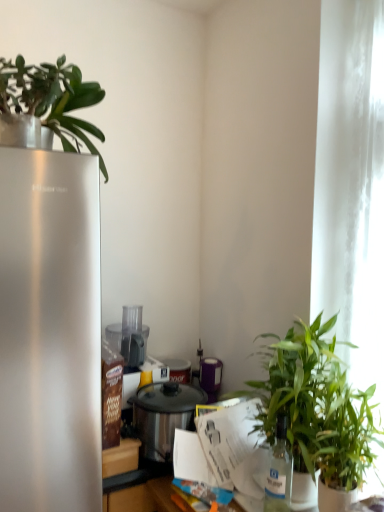
Question: Can you confirm if green leafy plant at right, the 3th houseplant positioned from the top, is positioned to the left of white glossy paper at center?

Choices:
 (A) no
 (B) yes

Answer: (A)

Question: Is green leafy plant at right, the 3th houseplant positioned from the top, positioned in front of white glossy paper at center?

Choices:
 (A) no
 (B) yes

Answer: (B)

Question: Can you confirm if green leafy plant at right, the 1th houseplant positioned from the right, is shorter than white glossy paper at center?

Choices:
 (A) yes
 (B) no

Answer: (B)

Question: Is green leafy plant at right, the 1th houseplant positioned from the right, facing away from white glossy paper at center?

Choices:
 (A) yes
 (B) no

Answer: (B)

Question: Is white glossy paper at center a part of green leafy plant at right, the third houseplant positioned from the left?

Choices:
 (A) yes
 (B) no

Answer: (B)

Question: Does point (326, 388) appear closer or farther from the camera than point (178, 394)?

Choices:
 (A) farther
 (B) closer

Answer: (B)

Question: Is green leafy plant at right, the 1th houseplant in the bottom-to-top sequence, to the left or to the right of stainless steel pot at center in the image?

Choices:
 (A) left
 (B) right

Answer: (B)

Question: From their relative heights in the image, would you say green leafy plant at right, the third houseplant positioned from the left, is taller or shorter than stainless steel pot at center?

Choices:
 (A) short
 (B) tall

Answer: (B)

Question: From the image's perspective, is green leafy plant at right, the 1th houseplant positioned from the right, located above or below stainless steel pot at center?

Choices:
 (A) below
 (B) above

Answer: (B)

Question: In terms of width, does stainless steel pot at center look wider or thinner when compared to white glossy paper at center?

Choices:
 (A) wide
 (B) thin

Answer: (A)

Question: From the image's perspective, is stainless steel pot at center above or below white glossy paper at center?

Choices:
 (A) below
 (B) above

Answer: (B)

Question: From their relative heights in the image, would you say stainless steel pot at center is taller or shorter than white glossy paper at center?

Choices:
 (A) short
 (B) tall

Answer: (B)

Question: In terms of size, does stainless steel pot at center appear bigger or smaller than white glossy paper at center?

Choices:
 (A) big
 (B) small

Answer: (A)

Question: Is white glossy paper at center in front of or behind white sheer curtain at right in the image?

Choices:
 (A) behind
 (B) front

Answer: (B)

Question: Looking at the image, does white glossy paper at center seem bigger or smaller compared to white sheer curtain at right?

Choices:
 (A) big
 (B) small

Answer: (B)